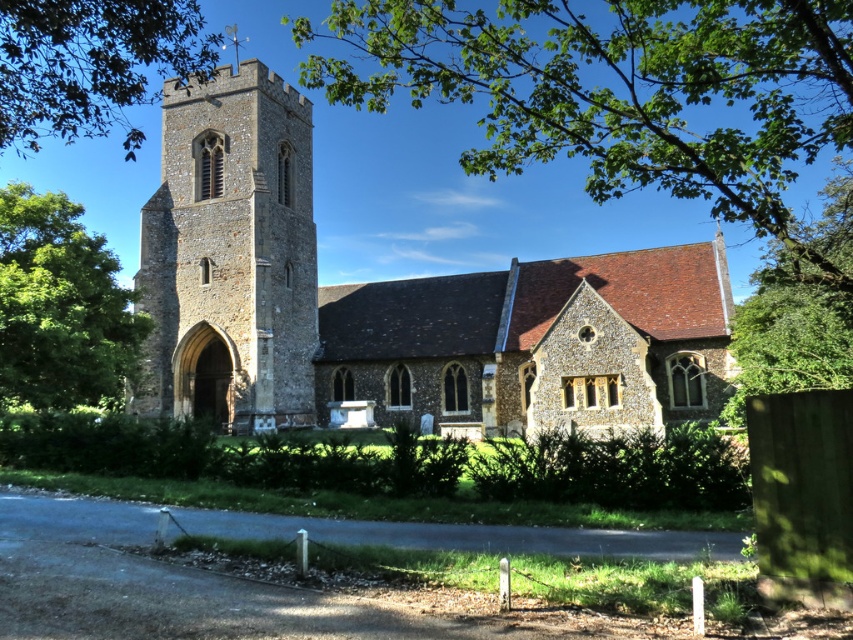
Locate an element on the screen. Image resolution: width=853 pixels, height=640 pixels. stone church at center is located at coordinates (392, 305).

Who is positioned more to the left, stone church at center or stone tower at center?

From the viewer's perspective, stone tower at center appears more on the left side.

Locate an element on the screen. The width and height of the screenshot is (853, 640). stone church at center is located at coordinates (392, 305).

Is stone tower at center positioned behind green leafy tree at upper left?

Yes, it is.

Who is taller, stone tower at center or green leafy tree at upper left?

stone tower at center is taller.

Does point (299, 186) come in front of point (50, 13)?

No, it is behind (50, 13).

The image size is (853, 640). In order to click on stone tower at center in this screenshot , I will do `click(230, 257)`.

Is stone church at center positioned before green leafy tree at left?

No, it is behind green leafy tree at left.

Does stone church at center have a greater width compared to green leafy tree at left?

Yes, stone church at center is wider than green leafy tree at left.

Does point (668, 396) come closer to viewer compared to point (13, 326)?

No, (668, 396) is further to viewer.

I want to click on stone church at center, so click(392, 305).